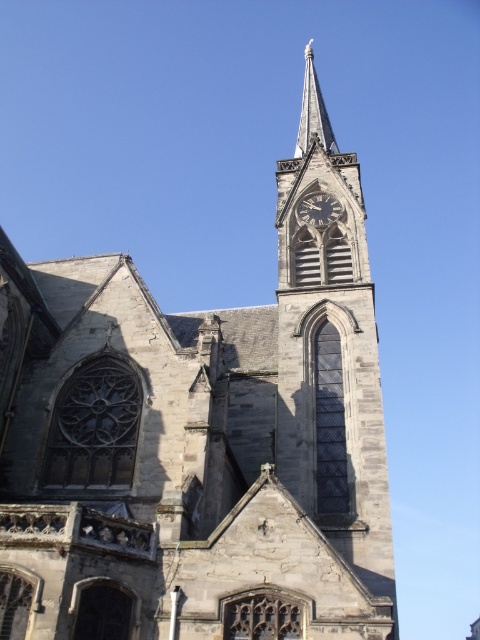
Can you confirm if gray stone spire at upper center is wider than dark gray stone clock at center?

Correct, the width of gray stone spire at upper center exceeds that of dark gray stone clock at center.

Is gray stone spire at upper center taller than dark gray stone clock at center?

Correct, gray stone spire at upper center is much taller as dark gray stone clock at center.

Where is `gray stone spire at upper center`? This screenshot has width=480, height=640. gray stone spire at upper center is located at coordinates (312, 112).